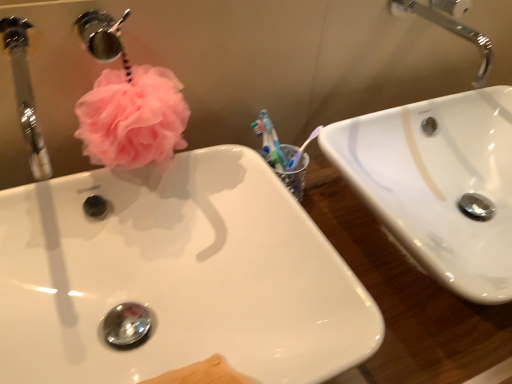
Question: Is white glossy sink at center, which is the 2th sink from right to left, closer to camera compared to white glossy sink at upper right, which appears as the second sink when viewed from the left?

Choices:
 (A) yes
 (B) no

Answer: (A)

Question: Considering the relative sizes of white glossy sink at center, the first sink from the left, and white glossy sink at upper right, which appears as the second sink when viewed from the left, in the image provided, is white glossy sink at center, the first sink from the left, smaller than white glossy sink at upper right, which appears as the second sink when viewed from the left,?

Choices:
 (A) no
 (B) yes

Answer: (B)

Question: Considering the relative sizes of white glossy sink at center, the first sink from the left, and white glossy sink at upper right, which appears as the second sink when viewed from the left, in the image provided, is white glossy sink at center, the first sink from the left, shorter than white glossy sink at upper right, which appears as the second sink when viewed from the left,?

Choices:
 (A) yes
 (B) no

Answer: (B)

Question: Is white glossy sink at center, which is the 2th sink from right to left, bigger than white glossy sink at upper right, the first sink in the right-to-left sequence?

Choices:
 (A) no
 (B) yes

Answer: (A)

Question: Is white glossy sink at center, the first sink from the left, looking in the opposite direction of white glossy sink at upper right, the first sink in the right-to-left sequence?

Choices:
 (A) no
 (B) yes

Answer: (A)

Question: In terms of height, does pink fluffy loofah at upper left look taller or shorter compared to white glossy sink at upper right, the first sink in the right-to-left sequence?

Choices:
 (A) tall
 (B) short

Answer: (B)

Question: Is pink fluffy loofah at upper left inside the boundaries of white glossy sink at upper right, which appears as the second sink when viewed from the left, or outside?

Choices:
 (A) inside
 (B) outside

Answer: (B)

Question: From the image's perspective, is pink fluffy loofah at upper left above or below white glossy sink at upper right, which appears as the second sink when viewed from the left?

Choices:
 (A) above
 (B) below

Answer: (A)

Question: Considering their positions, is pink fluffy loofah at upper left located in front of or behind white glossy sink at upper right, which appears as the second sink when viewed from the left?

Choices:
 (A) behind
 (B) front

Answer: (B)

Question: Looking at their shapes, would you say white glossy sink at upper right, the first sink in the right-to-left sequence, is wider or thinner than white glossy sink at center, which is the 2th sink from right to left?

Choices:
 (A) thin
 (B) wide

Answer: (A)

Question: Would you say white glossy sink at upper right, the first sink in the right-to-left sequence, is inside or outside white glossy sink at center, which is the 2th sink from right to left?

Choices:
 (A) inside
 (B) outside

Answer: (B)

Question: From the image's perspective, is white glossy sink at upper right, the first sink in the right-to-left sequence, above or below white glossy sink at center, the first sink from the left?

Choices:
 (A) below
 (B) above

Answer: (B)

Question: Considering the positions of white glossy sink at upper right, which appears as the second sink when viewed from the left, and white glossy sink at center, the first sink from the left, in the image, is white glossy sink at upper right, which appears as the second sink when viewed from the left, taller or shorter than white glossy sink at center, the first sink from the left,?

Choices:
 (A) tall
 (B) short

Answer: (B)

Question: Relative to brushed metal faucet at upper left, is chrome metallic faucet at upper right in front or behind?

Choices:
 (A) front
 (B) behind

Answer: (B)

Question: Do you think chrome metallic faucet at upper right is within brushed metal faucet at upper left, or outside of it?

Choices:
 (A) outside
 (B) inside

Answer: (A)